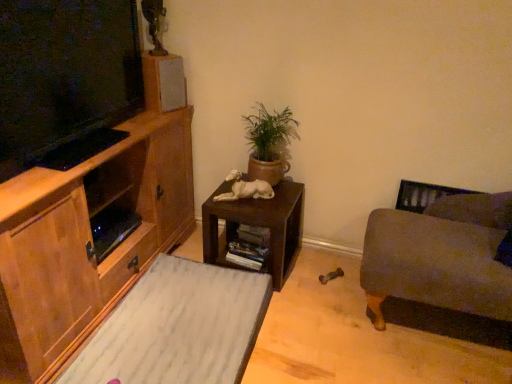
Identify the location of free point below velvet gray couch at right (from a real-world perspective). (441, 323).